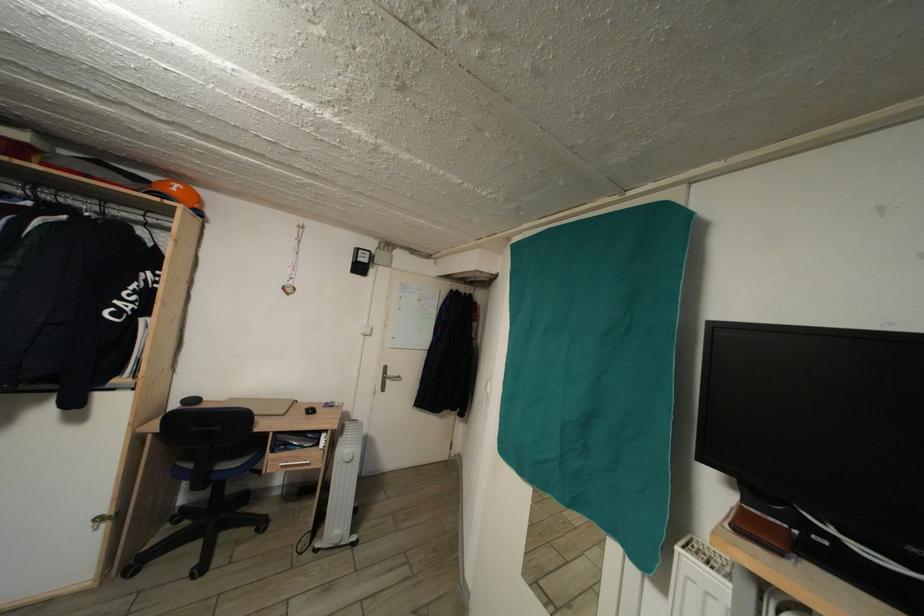
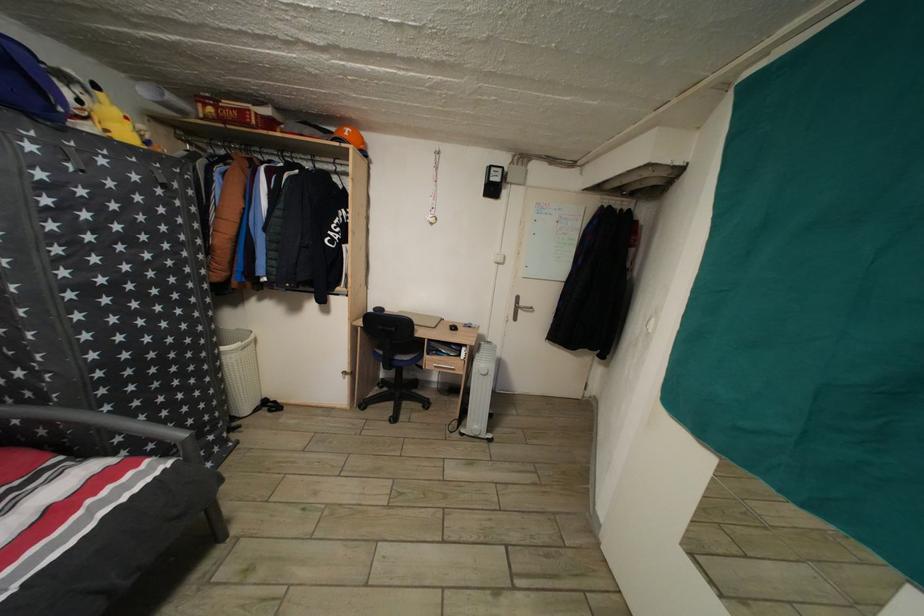
The point at (228, 472) is marked in the first image. Where is the corresponding point in the second image?

(406, 363)